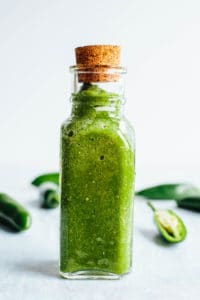
Find the location of `glass`. glass is located at coordinates (100, 101).